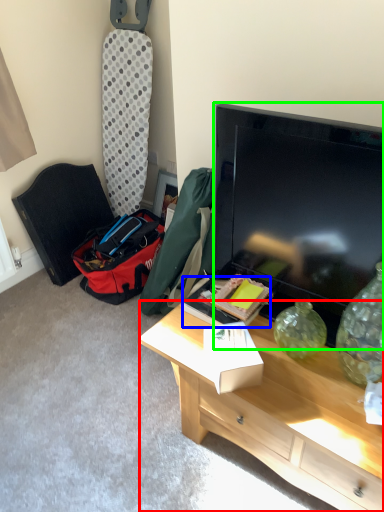
Question: Which object is positioned closest to desk (highlighted by a red box)? Select from box (highlighted by a blue box) and television (highlighted by a green box).

Choices:
 (A) box
 (B) television

Answer: (A)